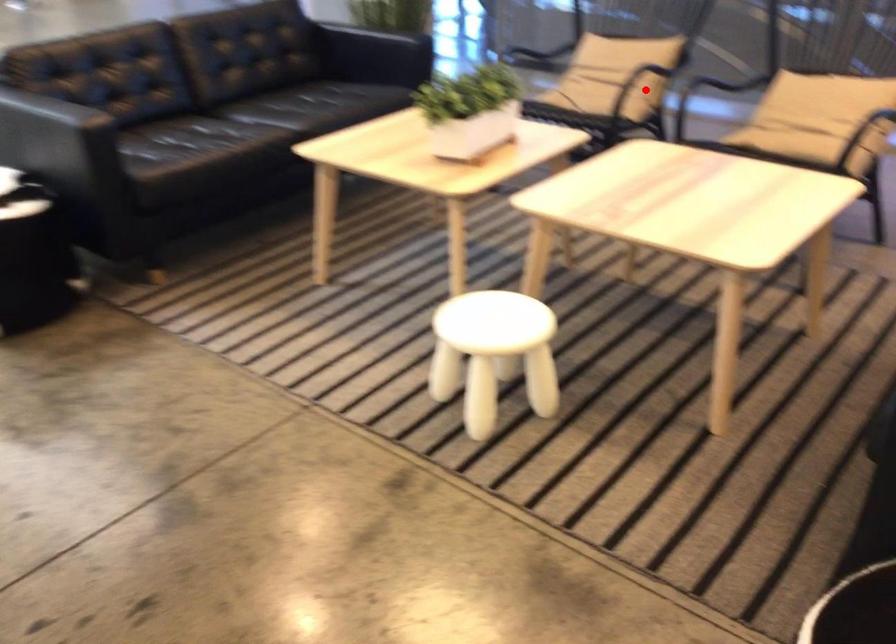
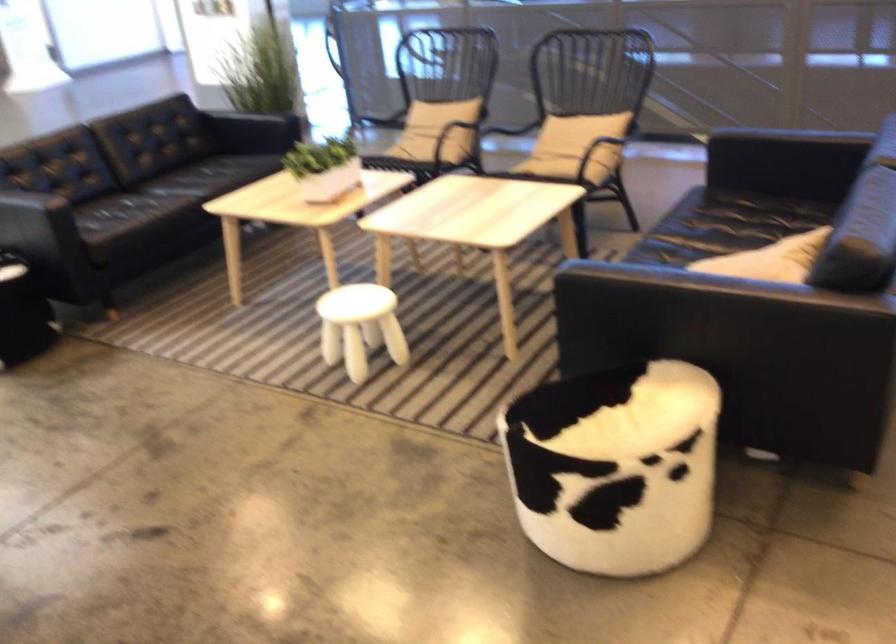
Question: I am providing you with two images of the same scene from different viewpoints. Image1 has a red point marked. In image2, the corresponding 3D location appears at what relative position? Reply with the corresponding letter.

Choices:
 (A) Closer
 (B) Farther

Answer: (B)